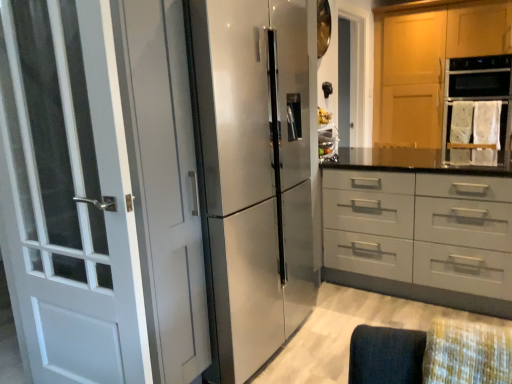
What do you see at coordinates (254, 176) in the screenshot?
I see `satin silver refrigerator at center` at bounding box center [254, 176].

What is the approximate width of satin silver refrigerator at center?

23.85 inches.

What do you see at coordinates (428, 63) in the screenshot? I see `wooden cabinet at upper right` at bounding box center [428, 63].

Identify the location of wooden cabinet at upper right. Image resolution: width=512 pixels, height=384 pixels. (428, 63).

The height and width of the screenshot is (384, 512). Find the location of `satin silver refrigerator at center`. satin silver refrigerator at center is located at coordinates (254, 176).

From the image's perspective, between wooden cabinet at upper right and satin silver refrigerator at center, who is located below?

satin silver refrigerator at center.

Is wooden cabinet at upper right wider than satin silver refrigerator at center?

Yes, wooden cabinet at upper right is wider than satin silver refrigerator at center.

Does point (385, 104) come in front of point (285, 262)?

No, it is not.

Which object is positioned more to the right, wooden cabinet at upper right or satin silver refrigerator at center?

wooden cabinet at upper right is more to the right.

Does white glossy door at left have a lesser height compared to wooden cabinet at upper right?

Correct, white glossy door at left is not as tall as wooden cabinet at upper right.

From the image's perspective, would you say white glossy door at left is shown under wooden cabinet at upper right?

Yes.

Is white glossy door at left spatially inside wooden cabinet at upper right, or outside of it?

white glossy door at left is outside wooden cabinet at upper right.

How much distance is there between white glossy door at left and wooden cabinet at upper right?

white glossy door at left and wooden cabinet at upper right are 11.33 feet apart from each other.

Is matte gray drawer at center taller or shorter than wooden cabinet at upper right?

Clearly, matte gray drawer at center is shorter compared to wooden cabinet at upper right.

Consider the image. Does matte gray drawer at center come behind wooden cabinet at upper right?

No, it is in front of wooden cabinet at upper right.

Can you tell me how much matte gray drawer at center and wooden cabinet at upper right differ in facing direction?

0.891 degrees separate the facing orientations of matte gray drawer at center and wooden cabinet at upper right.

In terms of width, does matte gray drawer at center look wider or thinner when compared to wooden cabinet at upper right?

matte gray drawer at center is wider than wooden cabinet at upper right.

Find the location of a particular element. The height and width of the screenshot is (384, 512). refrigerator above the white glossy door at left (from the image's perspective) is located at coordinates (254, 176).

Considering the relative sizes of white glossy door at left and satin silver refrigerator at center in the image provided, is white glossy door at left wider than satin silver refrigerator at center?

No.

Consider the image. What's the angular difference between white glossy door at left and satin silver refrigerator at center's facing directions?

86.6 degrees.

Looking at the image, does matte gray drawer at center seem bigger or smaller compared to satin silver refrigerator at center?

In the image, matte gray drawer at center appears to be larger than satin silver refrigerator at center.

How different are the orientations of matte gray drawer at center and satin silver refrigerator at center in degrees?

They differ by 89.9 degrees in their facing directions.

Which is behind, point (403, 178) or point (292, 189)?

Point (403, 178)

From the picture: Considering the sizes of objects matte gray drawer at center and satin silver refrigerator at center in the image provided, who is thinner, matte gray drawer at center or satin silver refrigerator at center?

satin silver refrigerator at center is thinner.

Does point (225, 28) come closer to viewer compared to point (364, 210)?

Yes, it is.

Does satin silver refrigerator at center touch matte gray drawer at center?

satin silver refrigerator at center is not next to matte gray drawer at center, and they're not touching.

Identify the location of refrigerator above the matte gray drawer at center (from a real-world perspective). (254, 176).

From the picture: From a real-world perspective, is satin silver refrigerator at center above or below matte gray drawer at center?

satin silver refrigerator at center is situated higher than matte gray drawer at center in the real world.

From a real-world perspective, does satin silver refrigerator at center stand above white glossy door at left?

Yes, from a real-world perspective, satin silver refrigerator at center is above white glossy door at left.

The image size is (512, 384). Find the location of `door beneath the satin silver refrigerator at center (from a real-world perspective)`. door beneath the satin silver refrigerator at center (from a real-world perspective) is located at coordinates (102, 190).

Is satin silver refrigerator at center completely or partially outside of white glossy door at left?

Yes, satin silver refrigerator at center is outside of white glossy door at left.

The image size is (512, 384). In order to click on cabinetry that appears on the right of satin silver refrigerator at center in this screenshot , I will do `click(428, 63)`.

Find the location of a particular element. The image size is (512, 384). door on the left of wooden cabinet at upper right is located at coordinates (102, 190).

Which object lies further to the anchor point wooden cabinet at upper right, satin silver refrigerator at center or white glossy door at left?

white glossy door at left.

Considering their positions, is matte gray drawer at center positioned further to white glossy door at left than wooden cabinet at upper right?

Among the two, wooden cabinet at upper right is located further to white glossy door at left.

Looking at the image, which one is located closer to wooden cabinet at upper right, matte gray drawer at center or satin silver refrigerator at center?

matte gray drawer at center lies closer to wooden cabinet at upper right than the other object.

From the image, which object appears to be farther from matte gray drawer at center, white glossy door at left or satin silver refrigerator at center?

white glossy door at left lies further to matte gray drawer at center than the other object.

In the scene shown: Based on their spatial positions, is satin silver refrigerator at center or white glossy door at left closer to matte gray drawer at center?

Based on the image, satin silver refrigerator at center appears to be nearer to matte gray drawer at center.

Looking at the image, which one is located further to white glossy door at left, wooden cabinet at upper right or satin silver refrigerator at center?

Based on the image, wooden cabinet at upper right appears to be further to white glossy door at left.

Based on their spatial positions, is wooden cabinet at upper right or matte gray drawer at center further from white glossy door at left?

wooden cabinet at upper right.

Estimate the real-world distances between objects in this image. Which object is further from satin silver refrigerator at center, wooden cabinet at upper right or white glossy door at left?

Based on the image, wooden cabinet at upper right appears to be further to satin silver refrigerator at center.

The height and width of the screenshot is (384, 512). Find the location of `drawer between satin silver refrigerator at center and wooden cabinet at upper right from front to back`. drawer between satin silver refrigerator at center and wooden cabinet at upper right from front to back is located at coordinates (421, 229).

Identify the location of drawer between white glossy door at left and wooden cabinet at upper right. (421, 229).

Locate an element on the screen. The width and height of the screenshot is (512, 384). refrigerator located between white glossy door at left and matte gray drawer at center in the left-right direction is located at coordinates (254, 176).

Find the location of a particular element. refrigerator located between white glossy door at left and wooden cabinet at upper right in the left-right direction is located at coordinates (254, 176).